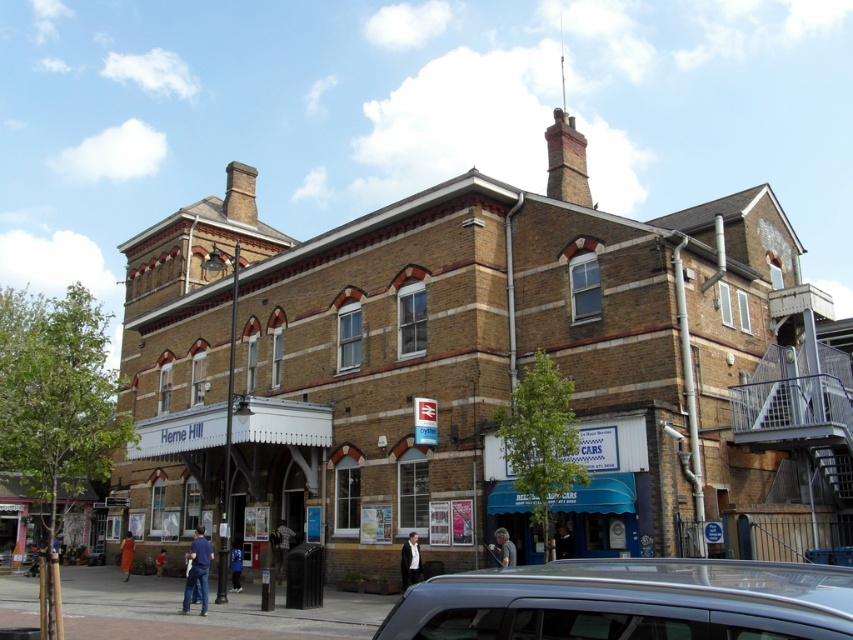
Question: Among these points, which one is farthest from the camera?

Choices:
 (A) (234, 426)
 (B) (627, 547)
 (C) (668, 624)

Answer: (A)

Question: Is silver metallic car at lower right above white wooden awning at center?

Choices:
 (A) yes
 (B) no

Answer: (A)

Question: Which point appears farthest from the camera in this image?

Choices:
 (A) (469, 593)
 (B) (608, 460)

Answer: (B)

Question: Is blue matte awning at lower center closer to the viewer compared to white wooden awning at center?

Choices:
 (A) no
 (B) yes

Answer: (B)

Question: Which of the following is the farthest from the observer?

Choices:
 (A) silver metallic car at lower right
 (B) blue matte awning at lower center

Answer: (B)

Question: Is blue matte awning at lower center bigger than white wooden awning at center?

Choices:
 (A) yes
 (B) no

Answer: (B)